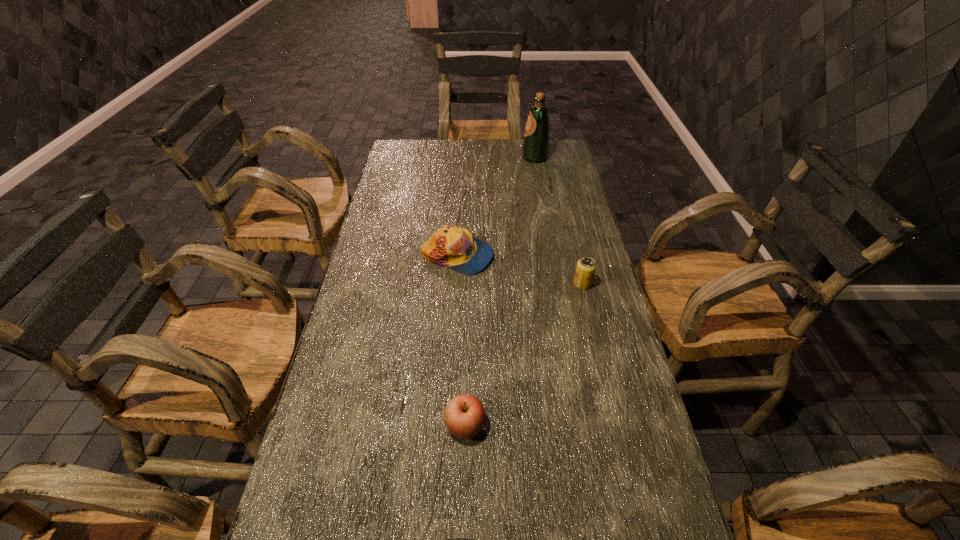
This screenshot has height=540, width=960. Find the location of `the tallest object`. the tallest object is located at coordinates (535, 149).

Find the location of a particular element. The width and height of the screenshot is (960, 540). olive oil is located at coordinates (535, 149).

Locate an element on the screen. Image resolution: width=960 pixels, height=540 pixels. the fourth nearest object is located at coordinates (451, 246).

Identify the location of beer can. (585, 270).

This screenshot has width=960, height=540. What are the coordinates of `apple` in the screenshot? It's located at 464,415.

Identify the location of vacant space situated on the front-facing side of the tallest object. (438, 158).

Identify the location of vacant space located 0.200m on the front-facing side of the tallest object. This screenshot has width=960, height=540. (475, 158).

Image resolution: width=960 pixels, height=540 pixels. Identify the location of free region located on the front-facing side of the tallest object. (507, 158).

This screenshot has width=960, height=540. I want to click on vacant region located on the bill of the second farthest object, so click(579, 256).

Where is `vacant space located 0.120m on the front of the third farthest object`? This screenshot has width=960, height=540. vacant space located 0.120m on the front of the third farthest object is located at coordinates click(591, 321).